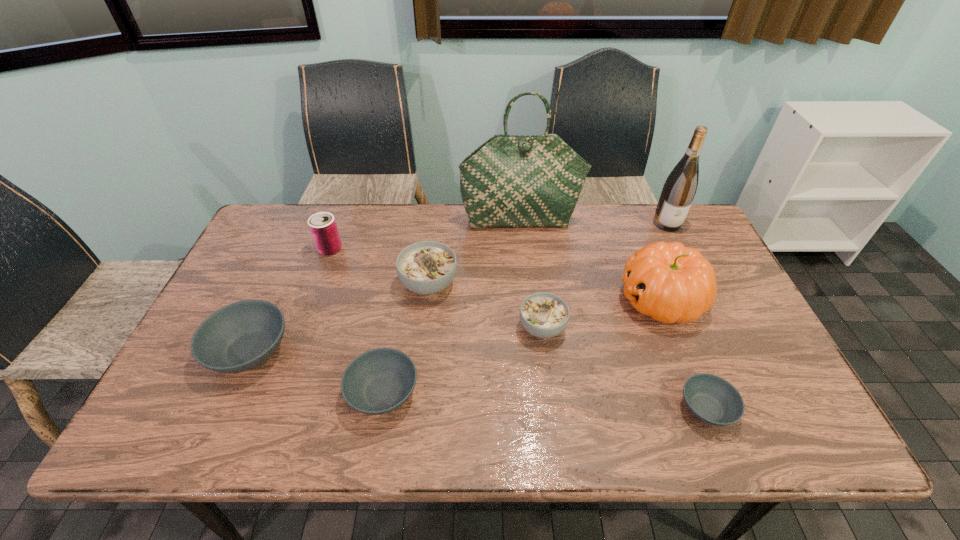
The image size is (960, 540). Find the location of `vacant position in the image that satisfies the following two spatial constraints: 1. on the label of the eighth shortest object; 2. on the carved face of the third tallest object`. vacant position in the image that satisfies the following two spatial constraints: 1. on the label of the eighth shortest object; 2. on the carved face of the third tallest object is located at coordinates (704, 299).

Where is `vacant area in the image that satisfies the following two spatial constraints: 1. on the back side of the fifth shortest object; 2. on the right side of the second shortest soup bowl`? The height and width of the screenshot is (540, 960). vacant area in the image that satisfies the following two spatial constraints: 1. on the back side of the fifth shortest object; 2. on the right side of the second shortest soup bowl is located at coordinates (402, 284).

Find the location of a particular element. The image size is (960, 540). free space that satisfies the following two spatial constraints: 1. on the front side of the smallest gray soup bowl; 2. on the left side of the biggest gray soup bowl is located at coordinates (225, 408).